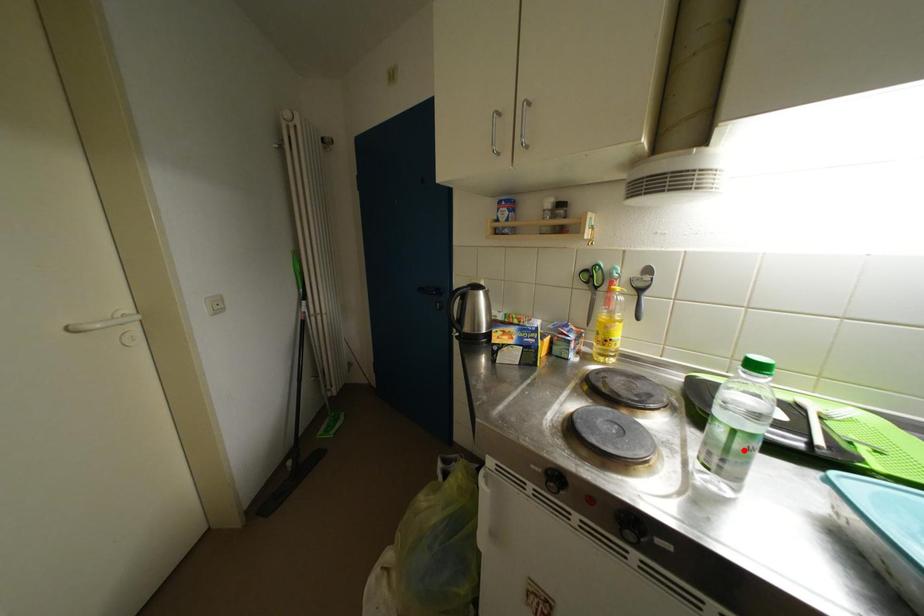
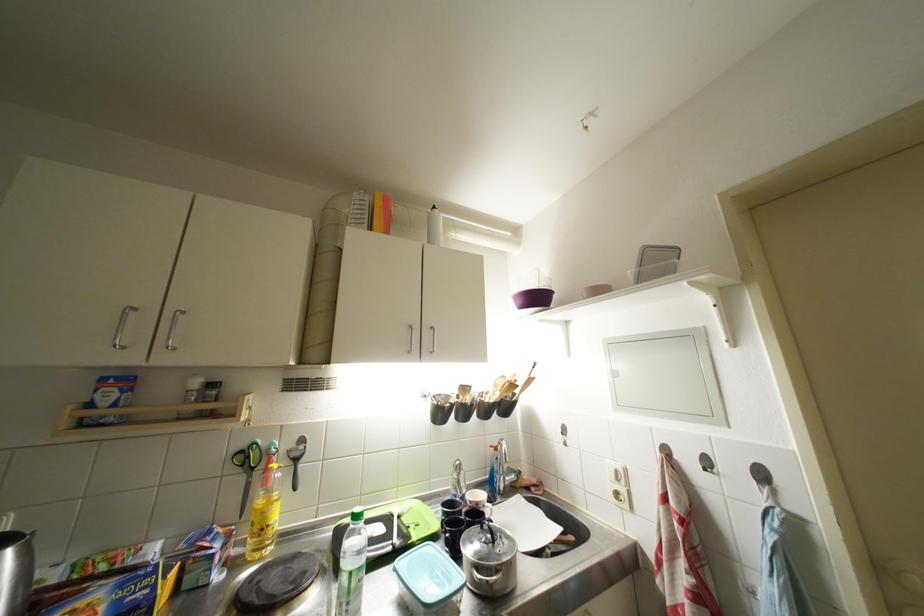
Where in the second image is the point corresponding to the highlighted location from the first image?

(359, 589)